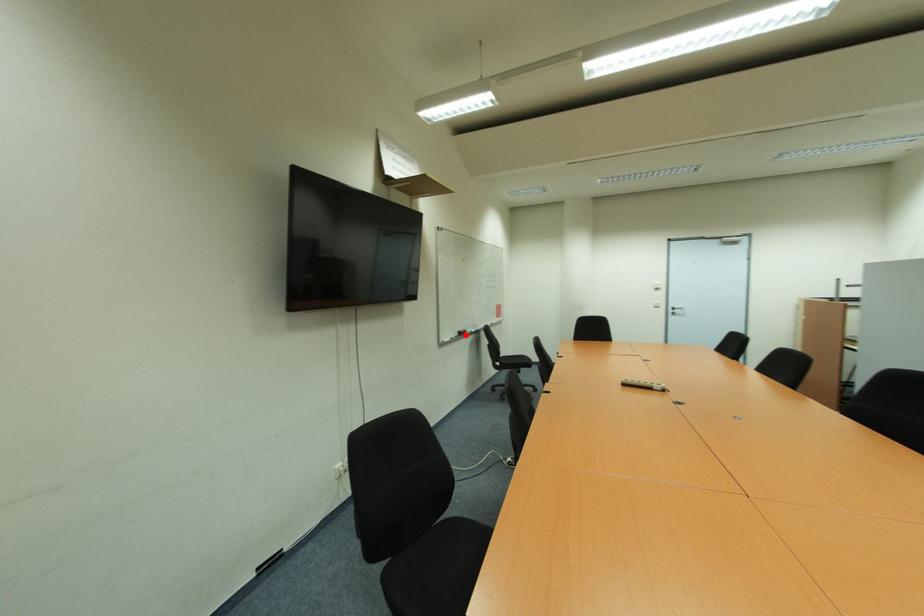
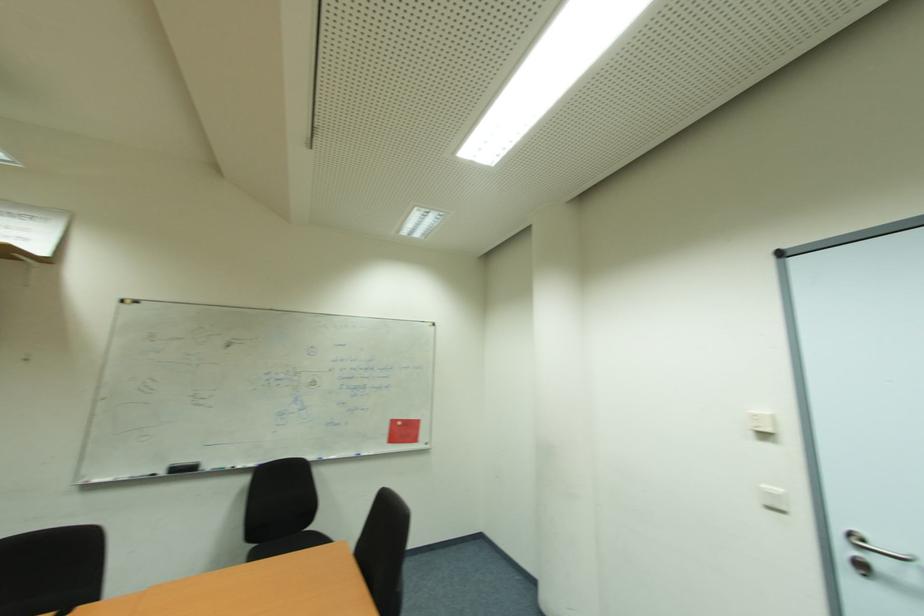
Question: I am providing you with two images of the same scene from different viewpoints. A red point is marked on the first image. At the location where the point appears in image 1, is it still visible in image 2?

Choices:
 (A) Yes
 (B) No

Answer: (A)